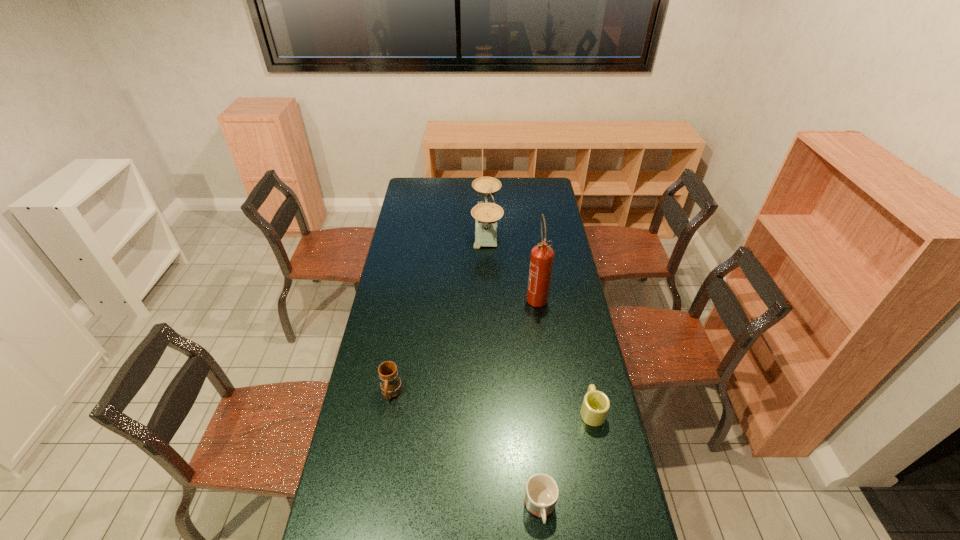
You are a GUI agent. You are given a task and a screenshot of the screen. Output one action in this format:
    pyautogui.click(x=<x>, y=<y>)
    Task: Click on the vacant space located on the front-facing side of the second tallest object
    The image size is (960, 540).
    Given the screenshot: What is the action you would take?
    pyautogui.click(x=417, y=228)

Identify the location of vacant space situated 0.070m on the front-facing side of the second tallest object. Image resolution: width=960 pixels, height=540 pixels. (459, 228).

Where is `free space located on the front-facing side of the second tallest object`? The height and width of the screenshot is (540, 960). free space located on the front-facing side of the second tallest object is located at coordinates (435, 228).

Find the location of a particular element. vacant space located on the side of the third tallest object with the handle is located at coordinates (378, 470).

The height and width of the screenshot is (540, 960). In order to click on vacant space located with the handle on the side of the rightmost mug in this screenshot , I will do `click(584, 373)`.

Find the location of a particular element. vacant region located with the handle on the side of the rightmost mug is located at coordinates (584, 373).

Locate an element on the screen. vacant space located with the handle on the side of the rightmost mug is located at coordinates (581, 358).

This screenshot has height=540, width=960. In order to click on object that is at the left edge in this screenshot , I will do `click(391, 386)`.

Where is `fire extinguisher that is at the right edge`? This screenshot has width=960, height=540. fire extinguisher that is at the right edge is located at coordinates (541, 261).

At what (x,y) coordinates should I click in order to perform the action: click on mug positioned at the right edge. Please return your answer as a coordinate pair (x, y). The height and width of the screenshot is (540, 960). Looking at the image, I should click on (596, 404).